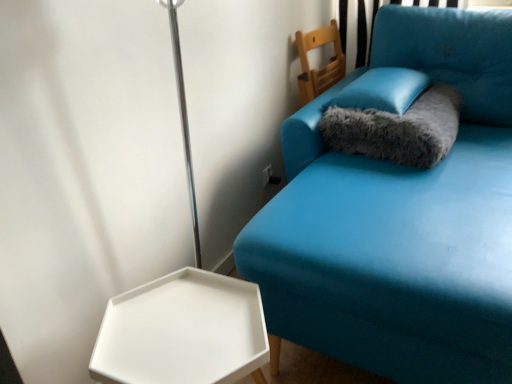
Question: Relative to fuzzy gray cat bed at upper right, is teal fabric couch at upper right in front or behind?

Choices:
 (A) behind
 (B) front

Answer: (B)

Question: Which is correct: teal fabric couch at upper right is inside fuzzy gray cat bed at upper right, or outside of it?

Choices:
 (A) inside
 (B) outside

Answer: (B)

Question: Which object is positioned closest to the fuzzy gray cat bed at upper right?

Choices:
 (A) white matte hexagonal tray at lower left
 (B) teal fabric couch at upper right
 (C) wooden chair at upper center
 (D) satin blue pillow at upper right

Answer: (D)

Question: Based on their relative distances, which object is farther from the satin blue pillow at upper right?

Choices:
 (A) white matte hexagonal tray at lower left
 (B) teal fabric couch at upper right
 (C) fuzzy gray cat bed at upper right
 (D) wooden chair at upper center

Answer: (A)